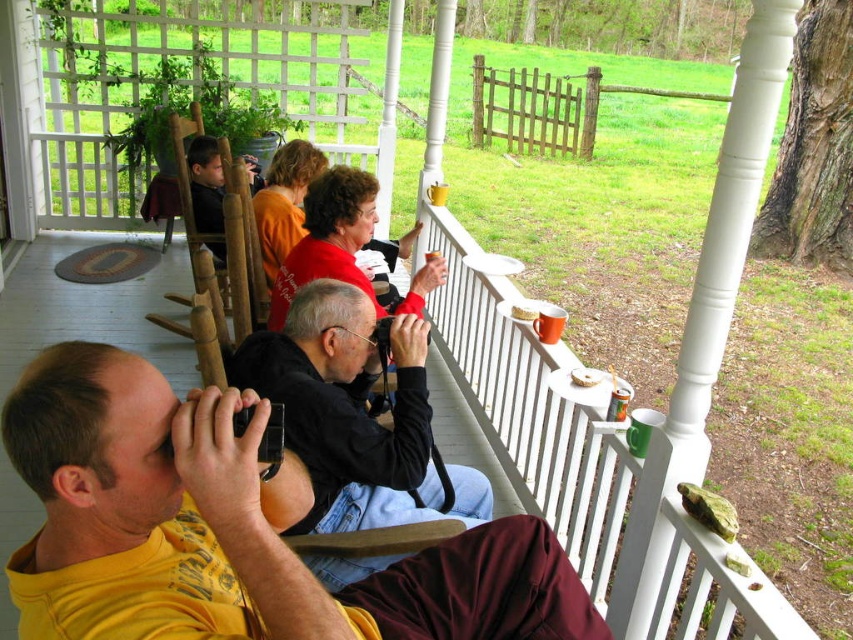
Can you confirm if yellow t-shirt at center is thinner than crumbly cake at upper center?

No, yellow t-shirt at center is not thinner than crumbly cake at upper center.

The image size is (853, 640). Describe the element at coordinates (228, 529) in the screenshot. I see `yellow t-shirt at center` at that location.

Find the location of a particular element. The image size is (853, 640). yellow t-shirt at center is located at coordinates (228, 529).

Can you confirm if brown wooden rocking chair at left is smaller than white crumbly cake at upper center?

Incorrect, brown wooden rocking chair at left is not smaller in size than white crumbly cake at upper center.

Does brown wooden rocking chair at left have a greater width compared to white crumbly cake at upper center?

Yes, brown wooden rocking chair at left is wider than white crumbly cake at upper center.

Between point (213, 278) and point (576, 371), which one is positioned behind?

The point (576, 371) is behind.

Where is `brown wooden rocking chair at left`? brown wooden rocking chair at left is located at coordinates (219, 228).

Between brown wooden rocking chair at left and crumbly cake at upper center, which one has less height?

crumbly cake at upper center is shorter.

Can you confirm if brown wooden rocking chair at left is shorter than crumbly cake at upper center?

No, brown wooden rocking chair at left is not shorter than crumbly cake at upper center.

Locate an element on the screen. The height and width of the screenshot is (640, 853). brown wooden rocking chair at left is located at coordinates (219, 228).